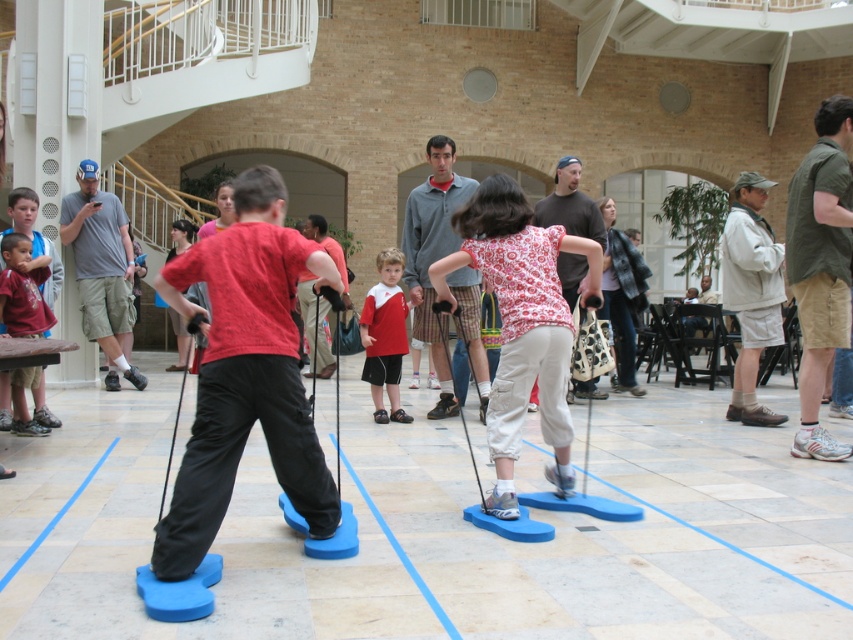
You are a photographer trying to capture both the khaki shorts at center and the dark brown sweater at center in a single shot. Which object should you focus on first to ensure both are in frame?

You should focus on the khaki shorts at center first since it is larger in size than the dark brown sweater at center, allowing you to frame both effectively.

You are standing in the atrium and want to take a photo of both point (457, 285) and point (724, 292) in the image. Which point should you focus on first to ensure both are in focus?

You should focus on point (457, 285) first because it is closer to the camera than point (724, 292), ensuring both will be in focus when using depth of field.